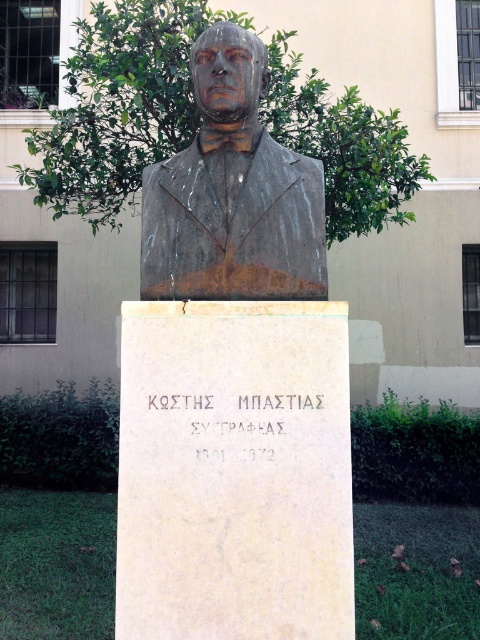
You are a gardener who needs to water the bronze statue at center. You have a hose that can reach up to 3 meters. Is the green leafy tree at upper center blocking your path to the statue? Consider the distance between them.

The distance between the green leafy tree at upper center and the bronze statue at center is 3.73 meters. Since the hose can only reach up to 3 meters, the tree is blocking the path, making it impossible to reach the statue with the current hose length.

From the picture: You are an art student analyzing the composition of the scene. Considering the green leafy tree at upper center and the bronze statue at center, which object occupies a larger vertical space in the image?

The green leafy tree at upper center has a greater height compared to the bronze statue at center, so it occupies a larger vertical space in the image.

You are an art student analyzing the image of a bronze bust on a pedestal. You notice a green leafy tree at upper center and a bronze statue at center. Based on their positions, which object is located to the left side of the other?

The green leafy tree at upper center is to the left of the bronze statue at center.